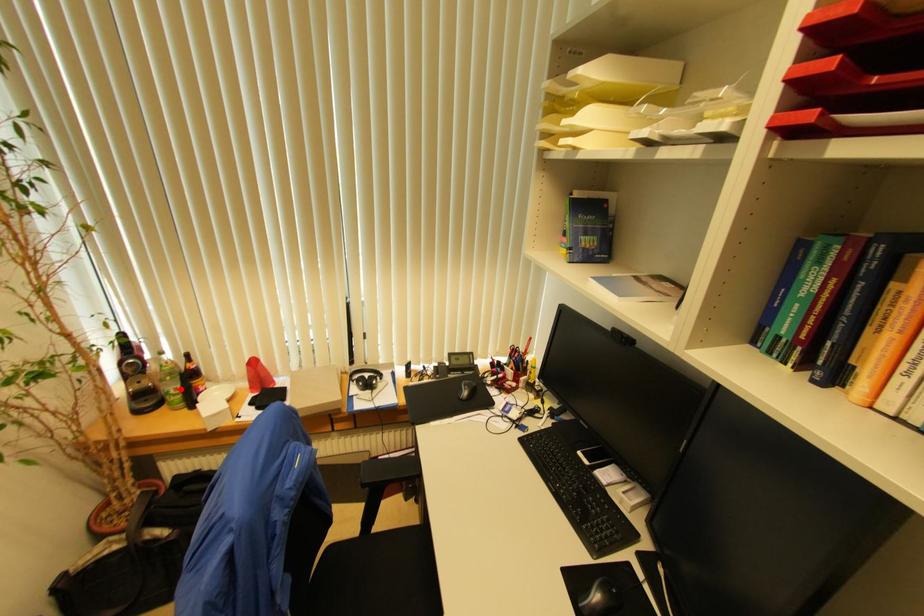
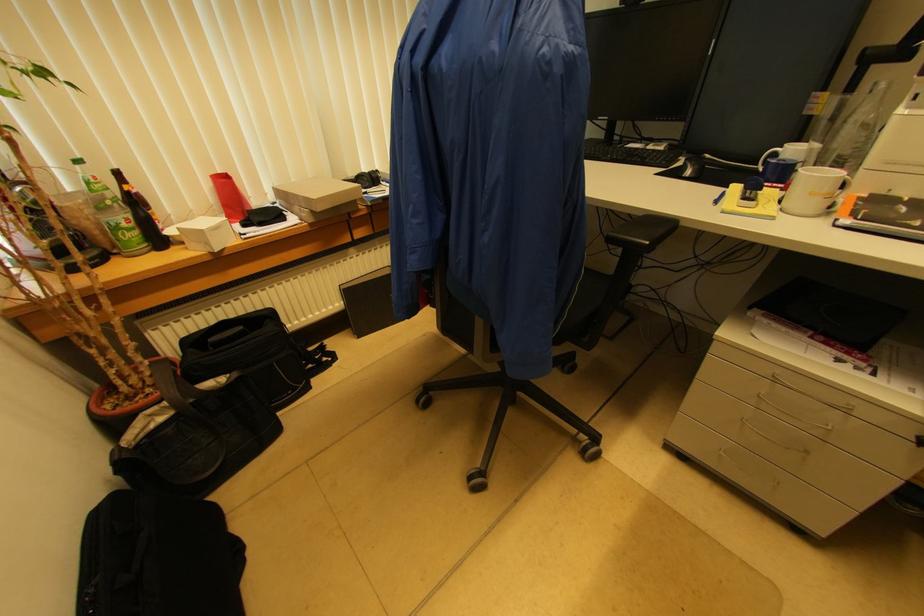
Locate, in the second image, the point that corresponds to the highlighted location in the first image.

(131, 219)